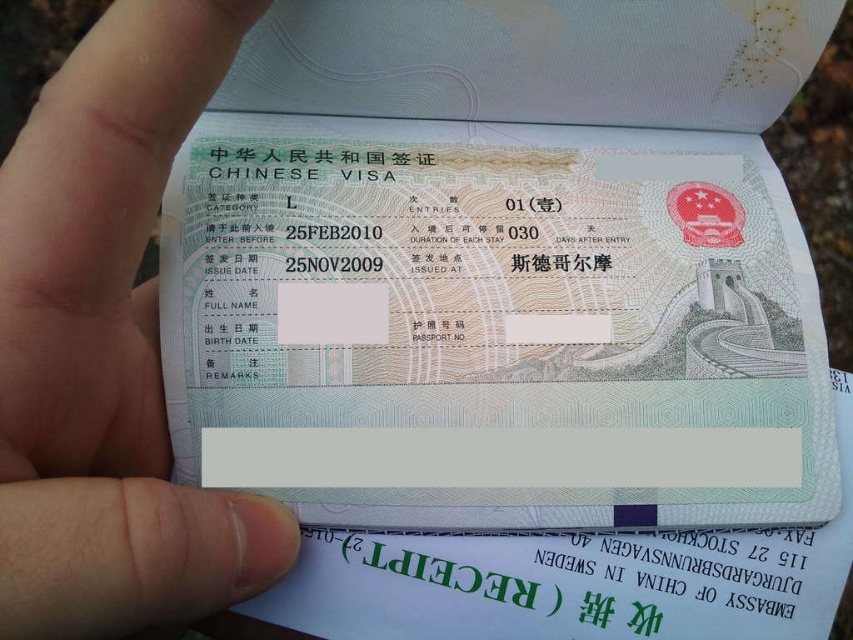
Which is above, light green paper visa at center or white matte paper at lower left?

light green paper visa at center is higher up.

Is light green paper visa at center shorter than white matte paper at lower left?

Correct, light green paper visa at center is not as tall as white matte paper at lower left.

Which is in front, point (248, 369) or point (160, 547)?

Point (160, 547) is in front.

Identify the location of light green paper visa at center. This screenshot has width=853, height=640. (492, 324).